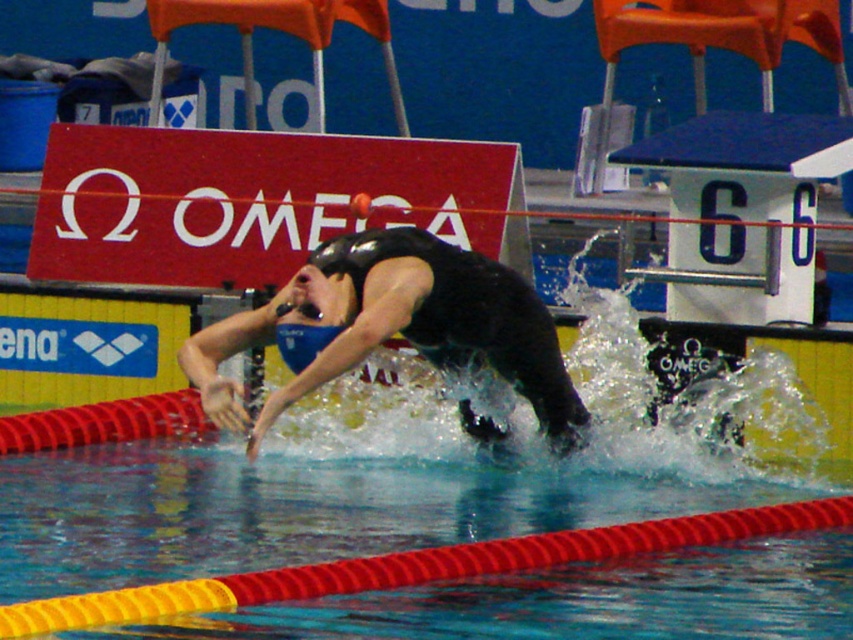
You are a lifeguard observing the swimmer in the pool. You notice the smooth rubber pool lane at center and the black matte swim cap at center. Which object is closer to the swimmer?

The smooth rubber pool lane at center is closer to the swimmer because it is shorter than the black matte swim cap at center, meaning it occupies less space between them.

You are a lifeguard standing at the edge of the pool. You need to place a floating rescue buoy between the smooth rubber pool lane at center and the black matte swim cap at center. The buoy is 12 inches in diameter. Is there enough space between them to fit the buoy without it touching either object?

The smooth rubber pool lane at center and black matte swim cap at center are 27.39 inches apart. The buoy requires at least 12 inches of space. Since 27.39 inches is greater than 12 inches, there is sufficient space to place the buoy between them without touching either object.